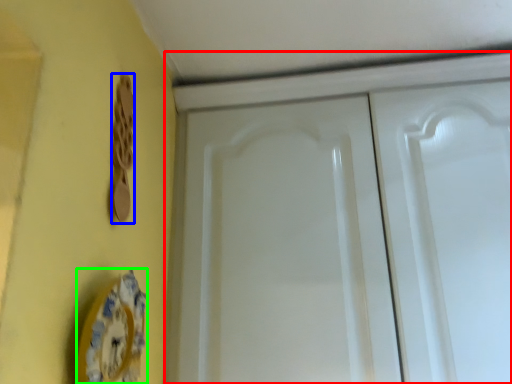
Question: Considering the real-world distances, which object is closest to cabinetry (highlighted by a red box)? door handle (highlighted by a blue box) or plate (highlighted by a green box).

Choices:
 (A) door handle
 (B) plate

Answer: (A)